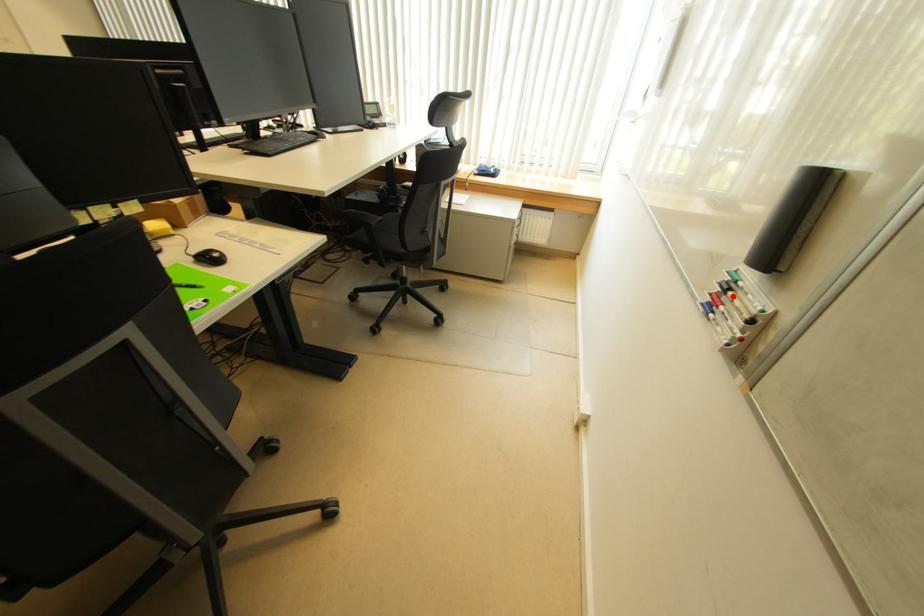
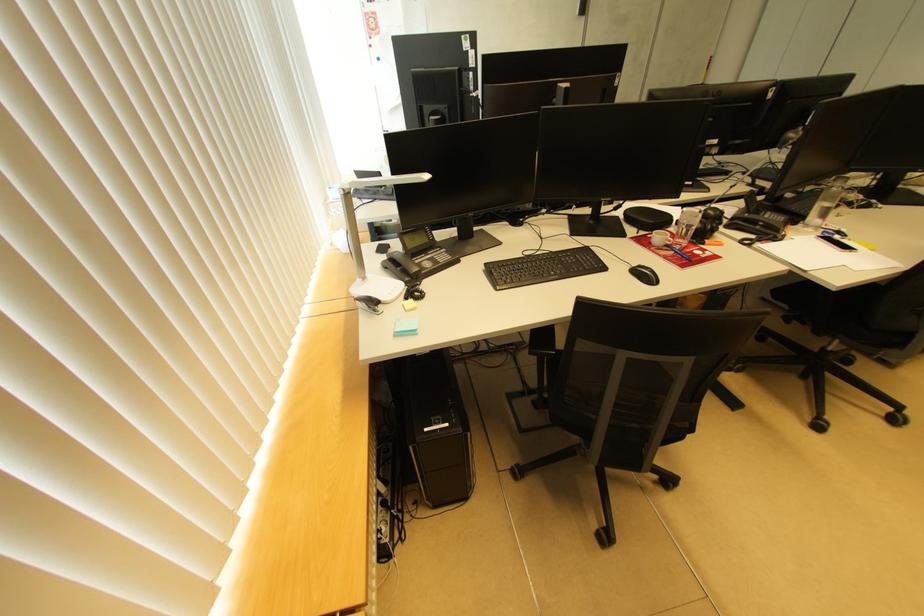
Question: I am providing you with two images of the same scene from different viewpoints. A red point is marked on the first image. Can you still see the location of the red point in image 2?

Choices:
 (A) Yes
 (B) No

Answer: (B)